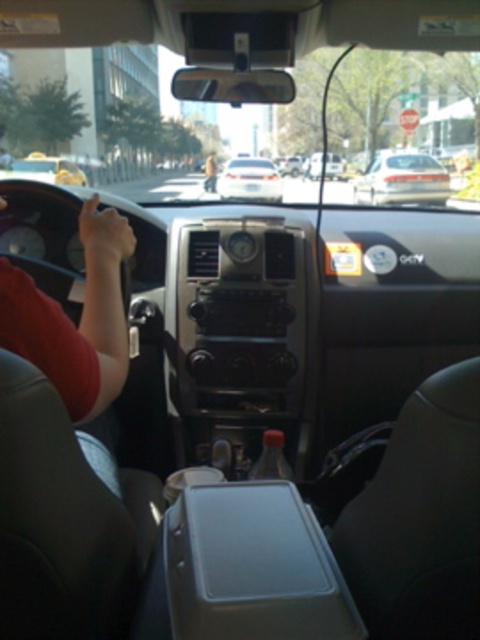
You are sitting in the passenger seat of a car and see both the metallic silver car at center and the light brown leather jacket at center. Which object takes up more space in your view?

The metallic silver car at center is bigger than the light brown leather jacket at center, so it takes up more space in your view.

Where is the white glossy sedan at center located in the image?

The white glossy sedan at center is located at point coordinates of [250,180].

You are sitting in the passenger seat of the car and want to hand the driver a light brown leather jacket at center. The driver is currently holding the steering wheel. Can you reach the jacket without moving your seat? The white glossy sedan at center is blocking your path.

The white glossy sedan at center is to the right of the light brown leather jacket at center, so the jacket is on the left side relative to the sedan. Since you are in the passenger seat, you can likely reach the jacket without moving your seat as it is positioned to the left of the sedan, which is in the center of the image.